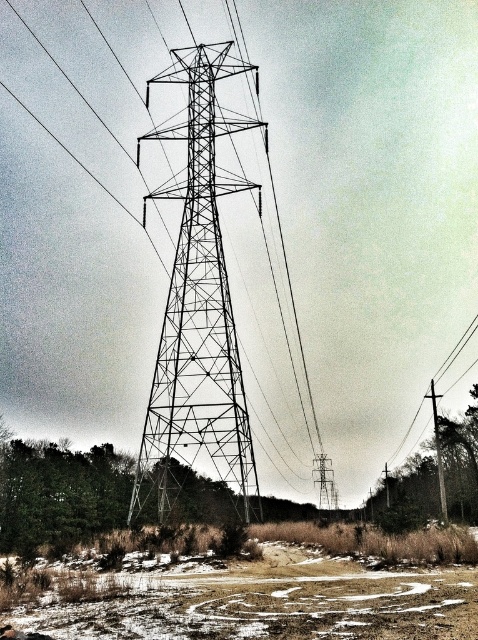
Can you confirm if brown grass at lower center is smaller than metallic wireframe tower at center?

Correct, brown grass at lower center occupies less space than metallic wireframe tower at center.

Is point (32, 628) behind point (208, 438)?

No, it is in front of (208, 438).

The width and height of the screenshot is (478, 640). In order to click on brown grass at lower center in this screenshot , I will do `click(258, 588)`.

Does metallic wireframe tower at center have a greater height compared to metallic wire at right?

Correct, metallic wireframe tower at center is much taller as metallic wire at right.

Between metallic wireframe tower at center and metallic wire at right, which one is positioned higher?

metallic wireframe tower at center

Does point (202, 285) come farther from viewer compared to point (440, 451)?

No, (202, 285) is closer to viewer.

The image size is (478, 640). Find the location of `metallic wireframe tower at center`. metallic wireframe tower at center is located at coordinates pos(197,305).

Which is below, brown grass at lower center or metallic wire at right?

brown grass at lower center is lower down.

What do you see at coordinates (258, 588) in the screenshot? The width and height of the screenshot is (478, 640). I see `brown grass at lower center` at bounding box center [258, 588].

Locate an element on the screen. Image resolution: width=478 pixels, height=640 pixels. brown grass at lower center is located at coordinates (258, 588).